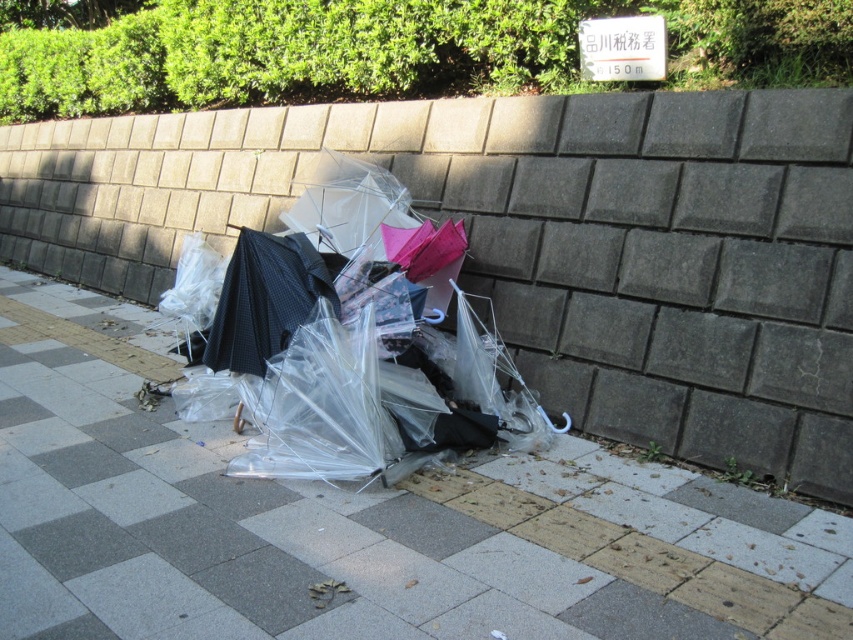
You are a waste collector who needs to determine if the transparent plastic umbrellas at lower center can fit inside the transparent plastic umbrella at center for easier disposal. Can they fit?

→ The transparent plastic umbrellas at lower center has a smaller size compared to transparent plastic umbrella at center, so yes, they can fit inside the transparent plastic umbrella at center for disposal.

You are standing on the sidewalk and see the transparent plastic umbrella at center and the transparent plastic umbrellas at center. Which one is closer to you?

The transparent plastic umbrella at center is closer to the viewer than the transparent plastic umbrellas at center.

You are a delivery person with a cart that is 4 meters long. You need to move your cart from the sidewalk to the brick wall. The transparent plastic umbrellas at lower center and the transparent plastic umbrella at center are in your way. Can you fit your cart between them?

The transparent plastic umbrellas at lower center and transparent plastic umbrella at center are 4.11 meters apart, so yes, the cart can fit between them since the distance is greater than the cart length.